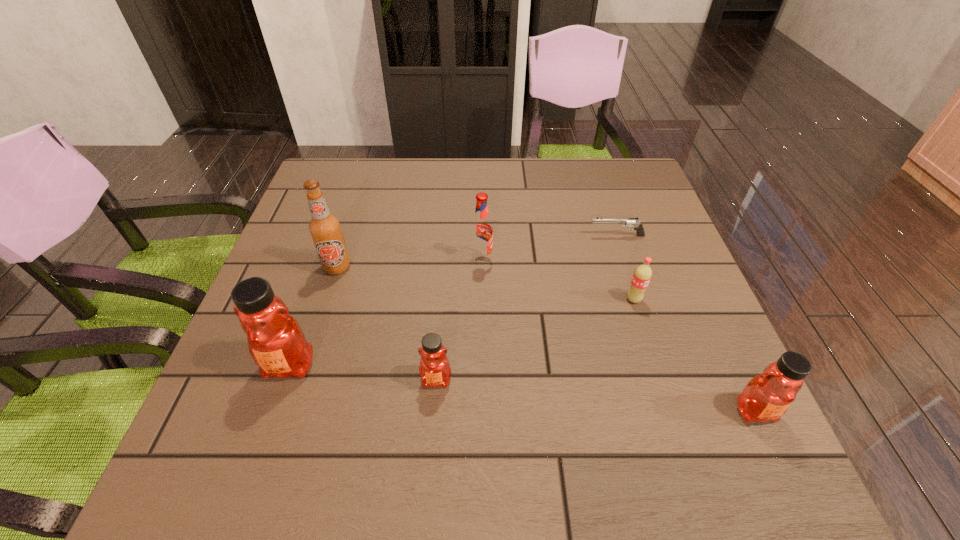
Image resolution: width=960 pixels, height=540 pixels. In order to click on the tallest honey in this screenshot , I will do `click(276, 342)`.

Locate an element on the screen. Image resolution: width=960 pixels, height=540 pixels. the second honey from left to right is located at coordinates (434, 368).

You are a GUI agent. You are given a task and a screenshot of the screen. Output one action in this format:
    pyautogui.click(x=<x>, y=<y>)
    Task: Click on the shortest honey
    The height and width of the screenshot is (540, 960).
    Given the screenshot: What is the action you would take?
    pyautogui.click(x=434, y=368)

Find the location of `the nearest object`. the nearest object is located at coordinates (767, 396).

Identify the location of the nearest honey. (767, 396).

Locate an element on the screen. This screenshot has width=960, height=540. the fourth farthest object is located at coordinates (642, 275).

You are a GUI agent. You are given a task and a screenshot of the screen. Output one action in this format:
    pyautogui.click(x=<x>, y=<y>)
    Task: Click on the fourth object from right to left
    The image size is (960, 540).
    Given the screenshot: What is the action you would take?
    pyautogui.click(x=481, y=232)

The height and width of the screenshot is (540, 960). What are the coordinates of `the shortest object` in the screenshot? It's located at (626, 222).

In order to click on the farthest object in this screenshot , I will do `click(626, 222)`.

Image resolution: width=960 pixels, height=540 pixels. What are the coordinates of `beer bottle` in the screenshot? It's located at (325, 229).